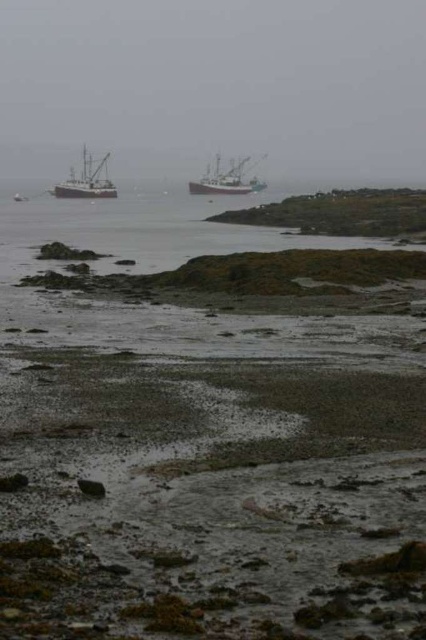
Between metallic gray fishing boat at left and white wooden ship at center, which one appears on the left side from the viewer's perspective?

Positioned to the left is metallic gray fishing boat at left.

Does metallic gray fishing boat at left appear on the right side of white wooden ship at center?

No, metallic gray fishing boat at left is not to the right of white wooden ship at center.

The height and width of the screenshot is (640, 426). Identify the location of metallic gray fishing boat at left. (86, 180).